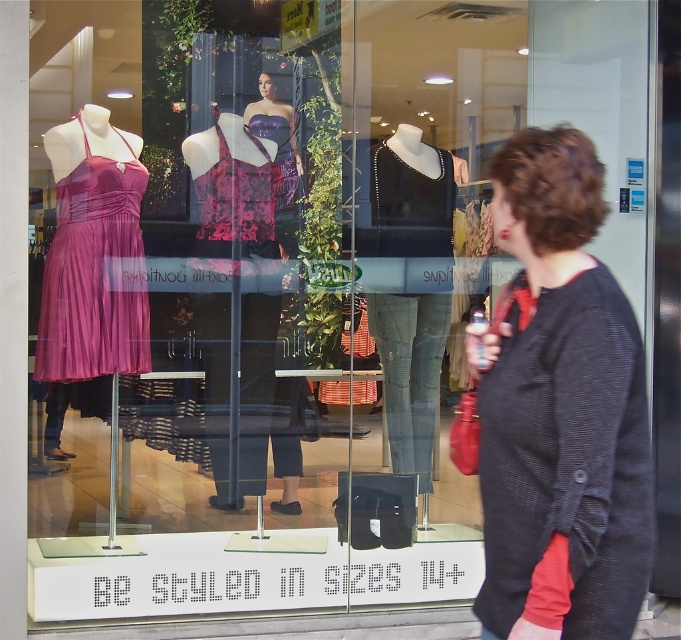
You are a customer standing outside the store looking at the window display. You want to know if you can comfortably reach both the black textured sweater at center and the matte purple dress at center at the same time without moving your arms. Can you do that?

The black textured sweater at center and the matte purple dress at center are 2.64 meters apart from each other. Since the average human arm span is about 1.5 meters, you cannot comfortably reach both items simultaneously without moving your arms.

You are a customer trying to decide between the black textured sweater at center and the purple pleated dress at left. If you want to choose the wider garment, which one should you pick?

The purple pleated dress at left is wider than the black textured sweater at center, so you should pick the purple pleated dress at left if you want the wider garment.